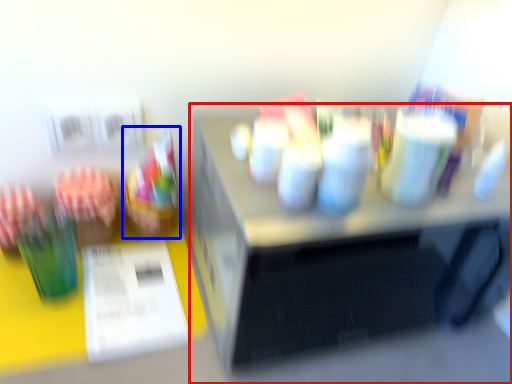
Question: Which of the following is the closest to the observer, desk (highlighted by a red box) or food (highlighted by a blue box)?

Choices:
 (A) desk
 (B) food

Answer: (A)